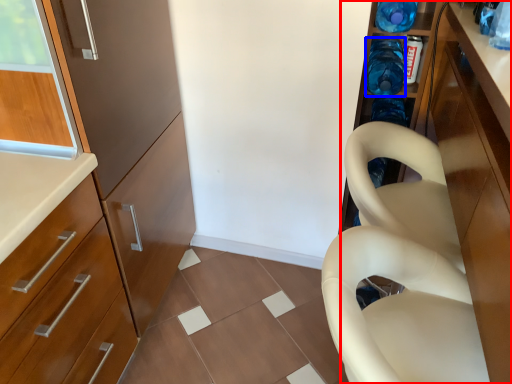
Question: Which object is further to the camera taking this photo, cabinetry (highlighted by a red box) or bottle (highlighted by a blue box)?

Choices:
 (A) cabinetry
 (B) bottle

Answer: (B)